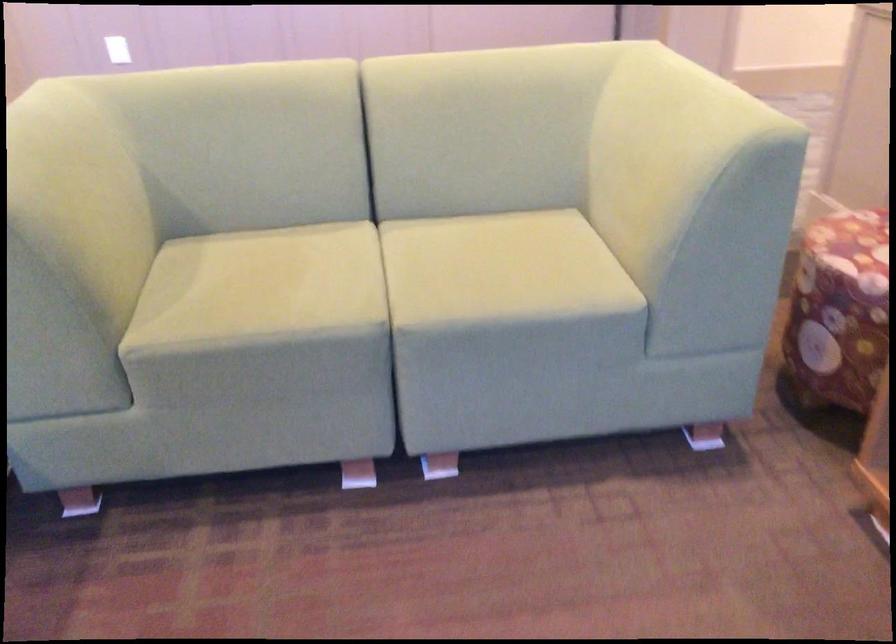
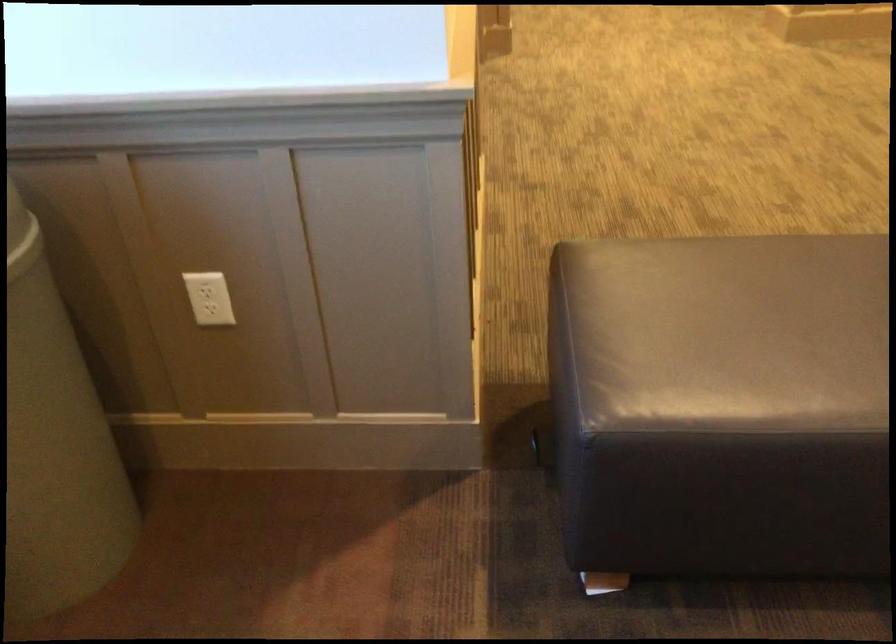
The first image is from the beginning of the video and the second image is from the end. How did the camera likely rotate when shooting the video?

The camera rotated toward left-down.